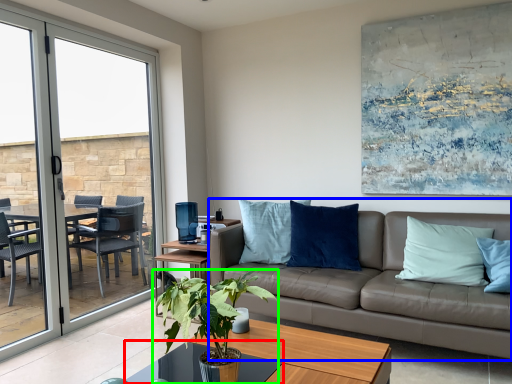
Question: Which object is the farthest from glass table (highlighted by a red box)? Choose among these: studio couch (highlighted by a blue box) or houseplant (highlighted by a green box).

Choices:
 (A) studio couch
 (B) houseplant

Answer: (A)